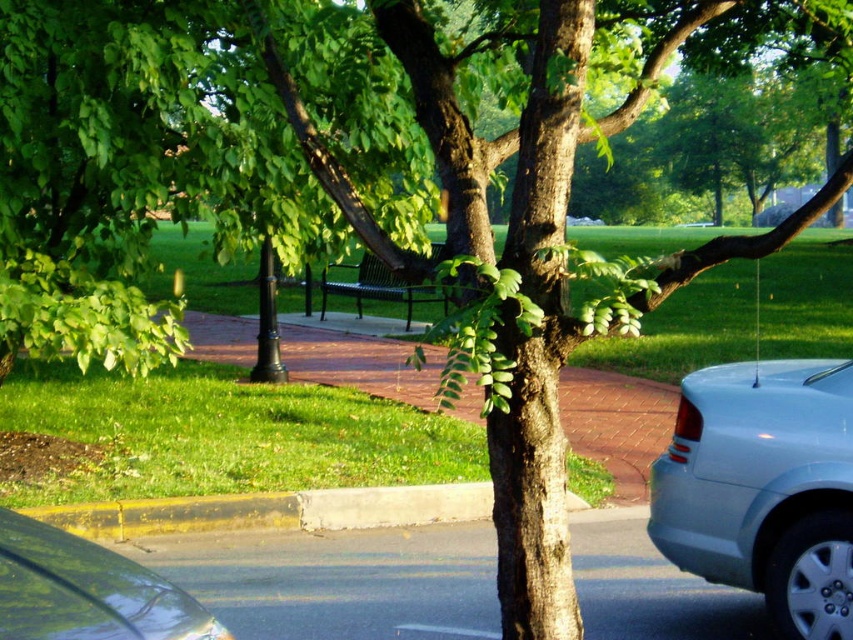
Question: Does satin silver sedan at lower right lie behind yellow asphalt curb at lower center?

Choices:
 (A) yes
 (B) no

Answer: (B)

Question: Which point is farther to the camera?

Choices:
 (A) satin silver sedan at lower right
 (B) yellow asphalt curb at lower center
 (C) clear glass windshield at lower left

Answer: (B)

Question: Which object is the closest to the satin silver sedan at lower right?

Choices:
 (A) clear glass windshield at lower left
 (B) yellow asphalt curb at lower center

Answer: (A)

Question: Can you confirm if satin silver sedan at lower right is smaller than yellow asphalt curb at lower center?

Choices:
 (A) yes
 (B) no

Answer: (B)

Question: Which point is farther to the camera?

Choices:
 (A) satin silver sedan at lower right
 (B) yellow asphalt curb at lower center

Answer: (B)

Question: Does satin silver sedan at lower right lie in front of clear glass windshield at lower left?

Choices:
 (A) yes
 (B) no

Answer: (B)